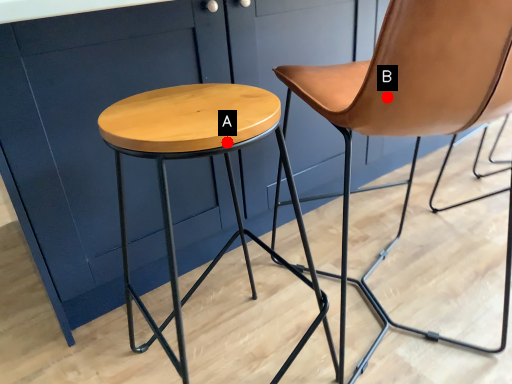
Question: Two points are circled on the image, labeled by A and B beside each circle. Which of the following is the closest to the observer?

Choices:
 (A) A is closer
 (B) B is closer

Answer: (A)